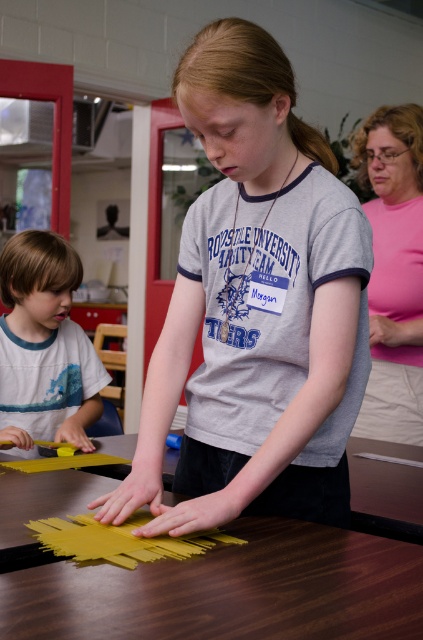
What is the color of the shirt worn by the child at the point with coordinates (x=255, y=307)?

The gray matte shirt at center is located at point (x=255, y=307), so the color is gray.

You are a teacher observing the classroom scene. You notice the gray matte shirt at center and the matte yellow paper at center. Which object is positioned closer to you?

The gray matte shirt at center is closer to the viewer than the matte yellow paper at center.

You are a teacher in the classroom. You need to place a new project kit on the wooden table at center and the matte yellow paper at center. Which surface can accommodate the larger project kit?

The wooden table at center has a larger size compared to matte yellow paper at center, so the wooden table at center can accommodate the larger project kit.